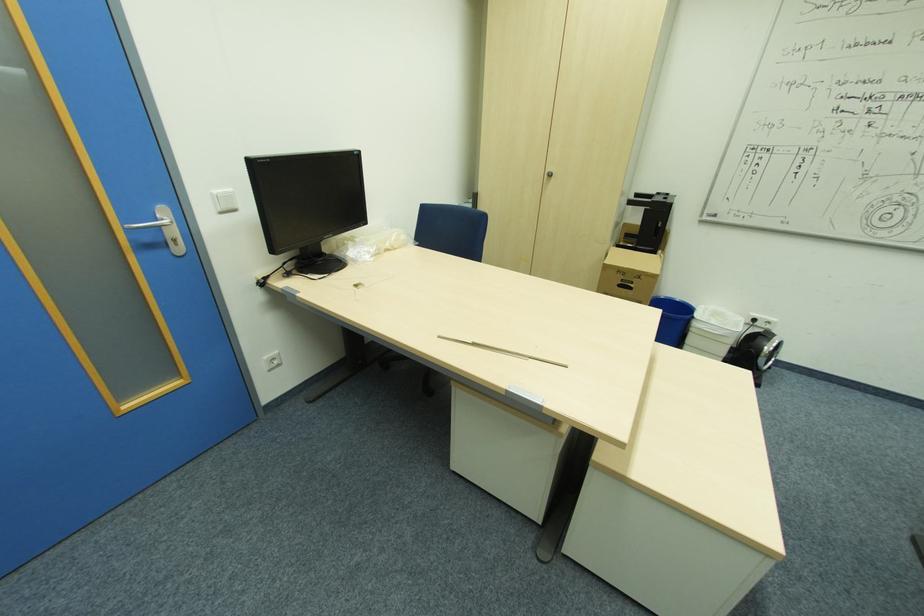
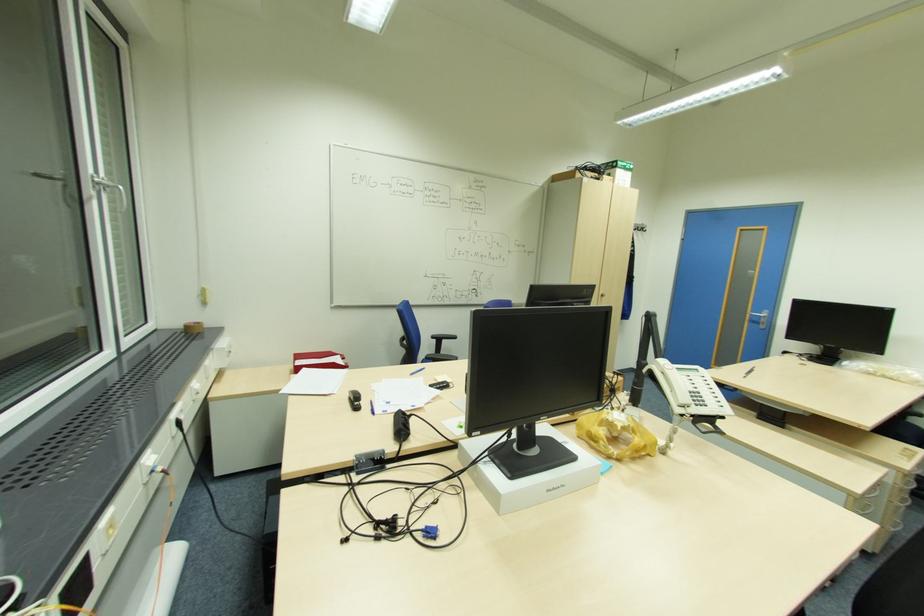
Question: I am providing you with two images of the same scene from different viewpoints. After the viewpoint changes to image2, which objects are now occluded?

Choices:
 (A) blue chair sitting surface
 (B) white laptop box
 (C) blue ballpoint pen
 (D) none of these

Answer: (D)